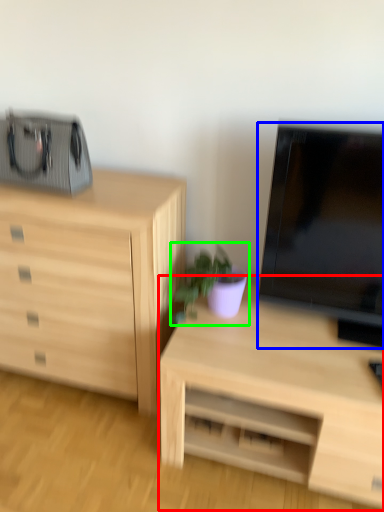
Question: Which object is the farthest from desk (highlighted by a red box)? Choose among these: television (highlighted by a blue box) or houseplant (highlighted by a green box).

Choices:
 (A) television
 (B) houseplant

Answer: (A)